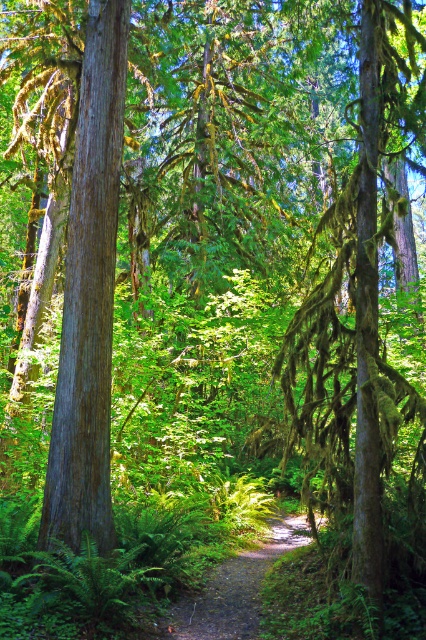
You are a hiker who wants to walk along the dirt path at center. There is a green mossy tree at center blocking your way. Can you walk around it? Please explain.

The green mossy tree at center is larger than the dirt path at center. Since the tree is bigger, it might occupy more space on the path, making it difficult to walk around it without leaving the path.

You are hiking along the dirt path at center and want to take a photo of the green mossy tree at center. To get a clear shot, should you move to your left or right?

The green mossy tree at center is to the right of the dirt path at center, so you should move to your right to get a clear shot.